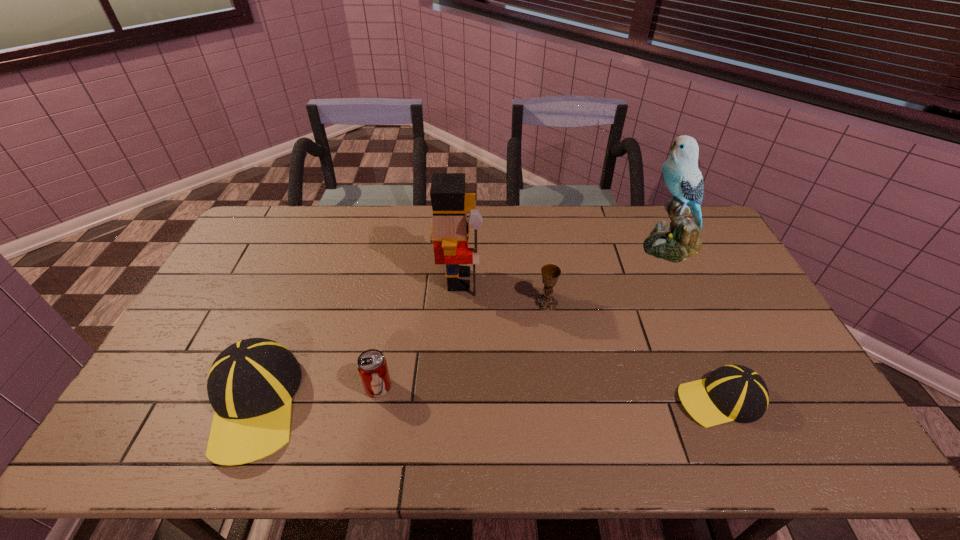
In order to click on baseball cap positioned at the right edge in this screenshot , I will do `click(730, 393)`.

Identify the location of parakeet that is at the right edge. (680, 240).

The width and height of the screenshot is (960, 540). Find the location of `object at the far right corner`. object at the far right corner is located at coordinates (680, 240).

Identify the location of object located in the near right corner section of the desktop. (730, 393).

At what (x,y) coordinates should I click in order to perform the action: click on vacant area at the far edge. Please return your answer as a coordinate pair (x, y). This screenshot has width=960, height=540. Looking at the image, I should click on (311, 218).

Locate an element on the screen. The image size is (960, 540). free region at the near edge of the desktop is located at coordinates (305, 410).

Where is `vacant position at the right edge of the desktop`? This screenshot has width=960, height=540. vacant position at the right edge of the desktop is located at coordinates (711, 249).

The image size is (960, 540). What are the coordinates of `free location at the far left corner of the desktop` in the screenshot? It's located at [x=255, y=238].

This screenshot has height=540, width=960. Identify the location of vacant region at the near left corner. (143, 413).

The image size is (960, 540). I want to click on free spot between the chalice and the second shortest object, so click(x=463, y=345).